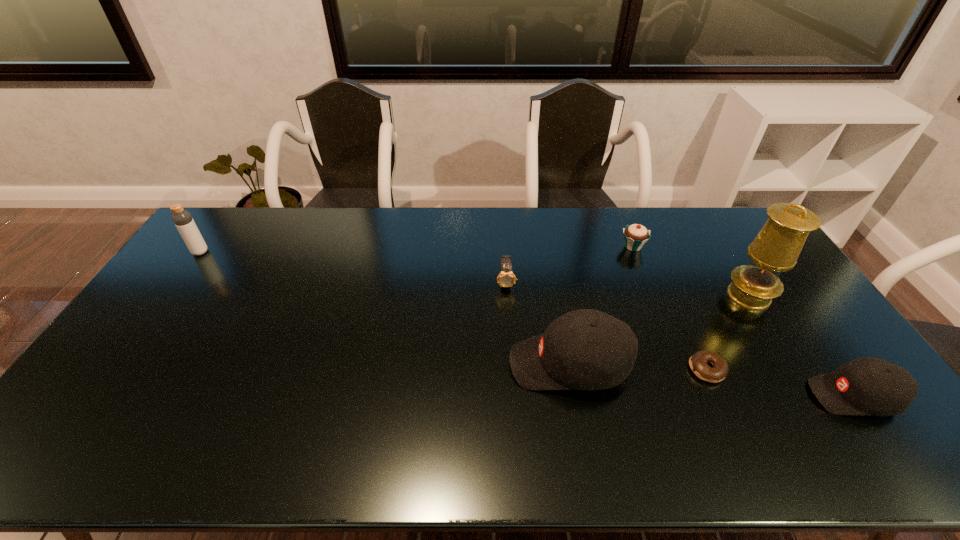
Find the location of a particular element. vacant position located with a logo on the front of the taller baseball cap is located at coordinates (393, 364).

Identify the location of vacant space located with a logo on the front of the taller baseball cap. The image size is (960, 540). (451, 364).

The height and width of the screenshot is (540, 960). I want to click on free location located 0.250m with a logo on the front of the right baseball cap, so click(x=714, y=396).

Find the location of `free spot located with a logo on the front of the right baseball cap`. free spot located with a logo on the front of the right baseball cap is located at coordinates (703, 396).

Where is `vacant area situated with a logo on the front of the right baseball cap`? vacant area situated with a logo on the front of the right baseball cap is located at coordinates [741, 396].

Locate an element on the screen. The width and height of the screenshot is (960, 540). vacant point located on the back of the cupcake is located at coordinates (624, 225).

Locate an element on the screen. blank space located 0.130m on the face of the watch is located at coordinates point(509,323).

I want to click on vacant space positioned on the back of the bottle, so click(x=216, y=231).

Image resolution: width=960 pixels, height=540 pixels. Find the location of `free space located 0.120m on the left of the tallest object`. free space located 0.120m on the left of the tallest object is located at coordinates (688, 296).

Where is `free spot located on the right of the shortest object`? This screenshot has width=960, height=540. free spot located on the right of the shortest object is located at coordinates (766, 369).